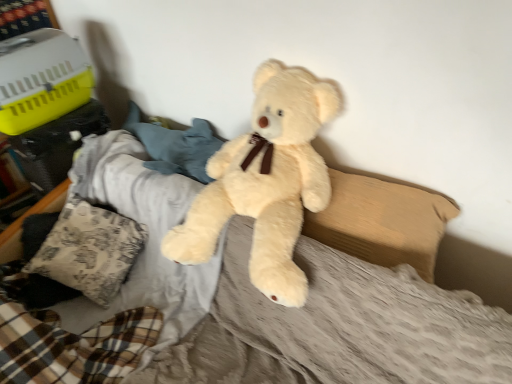
At what (x,y) coordinates should I click in order to perform the action: click on beige fabric pillow at center, which is the 1th pillow from right to left. Please return your answer as a coordinate pair (x, y). Looking at the image, I should click on (382, 222).

From a real-world perspective, relative to patterned fabric pillow at lower left, marked as the 1th pillow in a left-to-right arrangement, is beige fabric pillow at center, placed as the 2th pillow when sorted from left to right, vertically above or below?

beige fabric pillow at center, placed as the 2th pillow when sorted from left to right, is situated higher than patterned fabric pillow at lower left, marked as the 1th pillow in a left-to-right arrangement, in the real world.

Could you tell me if beige fabric pillow at center, which is the 1th pillow from right to left, is facing patterned fabric pillow at lower left, marked as the 1th pillow in a left-to-right arrangement?

No, beige fabric pillow at center, which is the 1th pillow from right to left, is not aimed at patterned fabric pillow at lower left, marked as the 1th pillow in a left-to-right arrangement.

Can you tell me how much beige fabric pillow at center, placed as the 2th pillow when sorted from left to right, and patterned fabric pillow at lower left, marked as the 1th pillow in a left-to-right arrangement, differ in facing direction?

2.48 degrees separate the facing orientations of beige fabric pillow at center, placed as the 2th pillow when sorted from left to right, and patterned fabric pillow at lower left, marked as the 1th pillow in a left-to-right arrangement.

Which object is positioned more to the right, beige fabric pillow at center, which is the 1th pillow from right to left, or patterned fabric pillow at lower left, marked as the 1th pillow in a left-to-right arrangement?

beige fabric pillow at center, which is the 1th pillow from right to left.

Is beige fabric pillow at center, which is the 1th pillow from right to left, outside of fluffy beige teddy bear at center?

No, beige fabric pillow at center, which is the 1th pillow from right to left, is not entirely external to fluffy beige teddy bear at center.

From the image's perspective, which is below, beige fabric pillow at center, placed as the 2th pillow when sorted from left to right, or fluffy beige teddy bear at center?

beige fabric pillow at center, placed as the 2th pillow when sorted from left to right.

Considering the relative positions of beige fabric pillow at center, which is the 1th pillow from right to left, and fluffy beige teddy bear at center in the image provided, is beige fabric pillow at center, which is the 1th pillow from right to left, to the left of fluffy beige teddy bear at center from the viewer's perspective?

No, beige fabric pillow at center, which is the 1th pillow from right to left, is not to the left of fluffy beige teddy bear at center.

At what (x,y) coordinates should I click in order to perform the action: click on pillow that appears on the right of fluffy beige teddy bear at center. Please return your answer as a coordinate pair (x, y). Looking at the image, I should click on (382, 222).

Which object is thinner, patterned fabric pillow at lower left, which is the second pillow from right to left, or fluffy beige teddy bear at center?

patterned fabric pillow at lower left, which is the second pillow from right to left.

Which is in front, point (101, 221) or point (298, 171)?

The point (298, 171) is closer.

Which object is positioned more to the right, patterned fabric pillow at lower left, which is the second pillow from right to left, or fluffy beige teddy bear at center?

fluffy beige teddy bear at center.

From a real-world perspective, is fluffy beige teddy bear at center physically above beige fabric pillow at center, placed as the 2th pillow when sorted from left to right?

Yes, from a real-world perspective, fluffy beige teddy bear at center is over beige fabric pillow at center, placed as the 2th pillow when sorted from left to right

Between point (256, 286) and point (319, 225), which one is positioned behind?

Positioned behind is point (319, 225).

Does fluffy beige teddy bear at center touch beige fabric pillow at center, placed as the 2th pillow when sorted from left to right?

They are not placed beside each other.

Is fluffy beige teddy bear at center taller or shorter than patterned fabric pillow at lower left, which is the second pillow from right to left?

Considering their sizes, fluffy beige teddy bear at center has more height than patterned fabric pillow at lower left, which is the second pillow from right to left.

From a real-world perspective, who is located higher, fluffy beige teddy bear at center or patterned fabric pillow at lower left, marked as the 1th pillow in a left-to-right arrangement?

fluffy beige teddy bear at center.

Looking at this image, how different are the orientations of fluffy beige teddy bear at center and patterned fabric pillow at lower left, which is the second pillow from right to left, in degrees?

5.17 degrees separate the facing orientations of fluffy beige teddy bear at center and patterned fabric pillow at lower left, which is the second pillow from right to left.

Who is more distant, fluffy beige teddy bear at center or patterned fabric pillow at lower left, which is the second pillow from right to left?

A: patterned fabric pillow at lower left, which is the second pillow from right to left.

Is patterned fabric pillow at lower left, marked as the 1th pillow in a left-to-right arrangement, oriented towards beige fabric pillow at center, placed as the 2th pillow when sorted from left to right?

No, patterned fabric pillow at lower left, marked as the 1th pillow in a left-to-right arrangement, is not facing towards beige fabric pillow at center, placed as the 2th pillow when sorted from left to right.

Is patterned fabric pillow at lower left, marked as the 1th pillow in a left-to-right arrangement, far from beige fabric pillow at center, which is the 1th pillow from right to left?

patterned fabric pillow at lower left, marked as the 1th pillow in a left-to-right arrangement, is actually quite close to beige fabric pillow at center, which is the 1th pillow from right to left.

From a real-world perspective, which object rests below the other?

In real-world perspective, patterned fabric pillow at lower left, which is the second pillow from right to left, is lower.

Consider the image. Would you say patterned fabric pillow at lower left, marked as the 1th pillow in a left-to-right arrangement, is inside or outside beige fabric pillow at center, which is the 1th pillow from right to left?

patterned fabric pillow at lower left, marked as the 1th pillow in a left-to-right arrangement, is outside beige fabric pillow at center, which is the 1th pillow from right to left.

In the image, there is a beige fabric pillow at center, which is the 1th pillow from right to left. Where is `pillow below it (from a real-world perspective)`? The width and height of the screenshot is (512, 384). pillow below it (from a real-world perspective) is located at coordinates (77, 254).

Identify the location of teddy bear positioned vertically above the beige fabric pillow at center, placed as the 2th pillow when sorted from left to right (from a real-world perspective). (266, 182).

Looking at the image, which one is located closer to beige fabric pillow at center, placed as the 2th pillow when sorted from left to right, fluffy beige teddy bear at center or patterned fabric pillow at lower left, which is the second pillow from right to left?

Among the two, fluffy beige teddy bear at center is located nearer to beige fabric pillow at center, placed as the 2th pillow when sorted from left to right.

When comparing their distances from patterned fabric pillow at lower left, which is the second pillow from right to left, does fluffy beige teddy bear at center or beige fabric pillow at center, which is the 1th pillow from right to left, seem further?

beige fabric pillow at center, which is the 1th pillow from right to left, is positioned further to the anchor patterned fabric pillow at lower left, which is the second pillow from right to left.

Based on their spatial positions, is patterned fabric pillow at lower left, which is the second pillow from right to left, or fluffy beige teddy bear at center closer to beige fabric pillow at center, which is the 1th pillow from right to left?

fluffy beige teddy bear at center.

Which object lies further to the anchor point fluffy beige teddy bear at center, beige fabric pillow at center, placed as the 2th pillow when sorted from left to right, or patterned fabric pillow at lower left, marked as the 1th pillow in a left-to-right arrangement?

patterned fabric pillow at lower left, marked as the 1th pillow in a left-to-right arrangement, lies further to fluffy beige teddy bear at center than the other object.

Which object lies further to the anchor point fluffy beige teddy bear at center, patterned fabric pillow at lower left, which is the second pillow from right to left, or beige fabric pillow at center, which is the 1th pillow from right to left?

patterned fabric pillow at lower left, which is the second pillow from right to left, is further to fluffy beige teddy bear at center.

When comparing their distances from patterned fabric pillow at lower left, marked as the 1th pillow in a left-to-right arrangement, does beige fabric pillow at center, placed as the 2th pillow when sorted from left to right, or fluffy beige teddy bear at center seem closer?

The object closer to patterned fabric pillow at lower left, marked as the 1th pillow in a left-to-right arrangement, is fluffy beige teddy bear at center.

Image resolution: width=512 pixels, height=384 pixels. Identify the location of teddy bear located between patterned fabric pillow at lower left, which is the second pillow from right to left, and beige fabric pillow at center, placed as the 2th pillow when sorted from left to right, in the left-right direction. (266, 182).